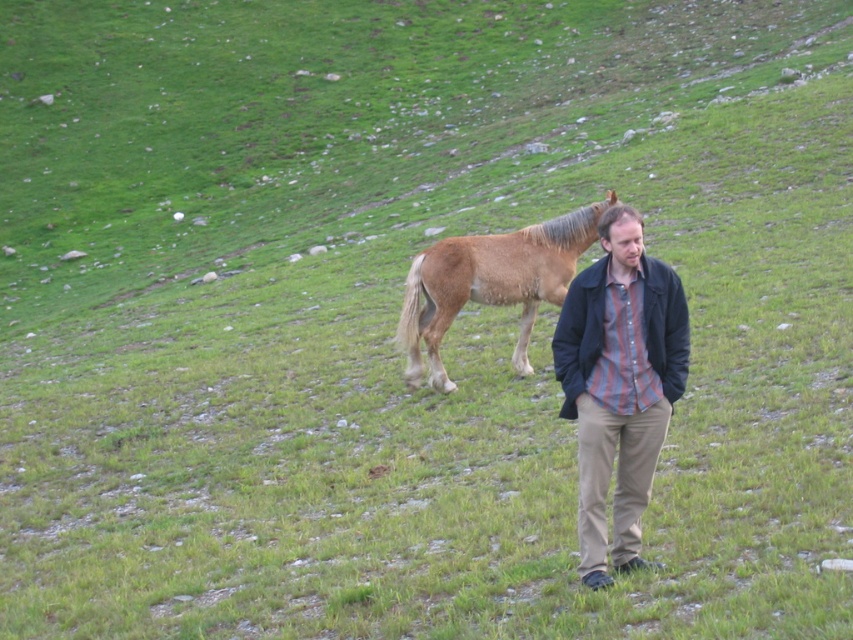
Question: Does striped cotton shirt at center appear on the right side of brown fuzzy horse at center?

Choices:
 (A) yes
 (B) no

Answer: (B)

Question: In this image, where is striped cotton shirt at center located relative to brown fuzzy horse at center?

Choices:
 (A) right
 (B) left

Answer: (B)

Question: Does striped cotton shirt at center have a lesser width compared to brown fuzzy horse at center?

Choices:
 (A) no
 (B) yes

Answer: (A)

Question: Which of the following is the closest to the observer?

Choices:
 (A) (613, 392)
 (B) (408, 381)

Answer: (A)